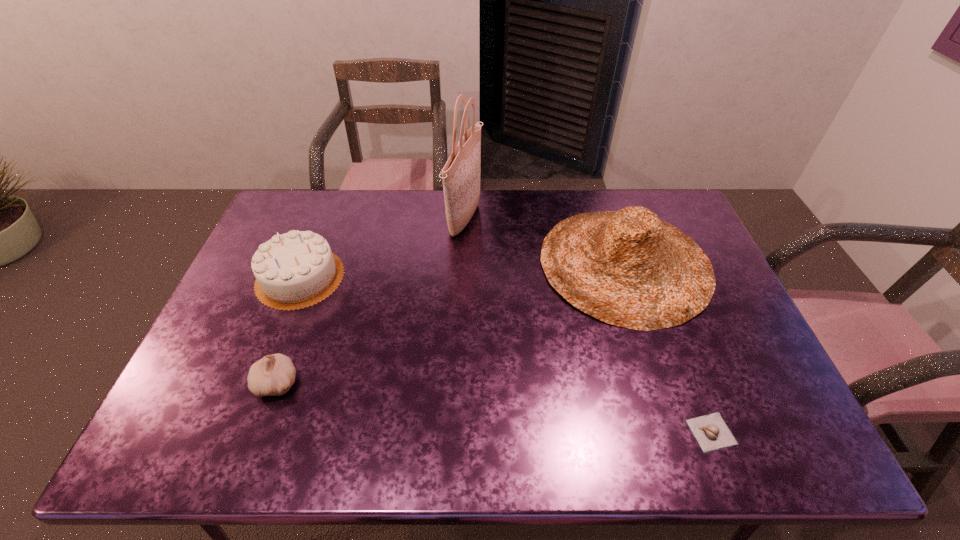
At what (x,y) coordinates should I click in order to perform the action: click on free area in between the sunhat and the second shortest object. Please return your answer as a coordinate pair (x, y). The width and height of the screenshot is (960, 540). Looking at the image, I should click on (451, 323).

Identify the location of free space between the taller garlic and the shortest object. The image size is (960, 540). (494, 408).

This screenshot has height=540, width=960. I want to click on free space that is in between the nearer garlic and the sunhat, so click(x=668, y=348).

Where is `vacant space that is in between the tallest object and the fourth farthest object`? Image resolution: width=960 pixels, height=540 pixels. vacant space that is in between the tallest object and the fourth farthest object is located at coordinates (371, 301).

Locate an element on the screen. unoccupied position between the farther garlic and the third object from left to right is located at coordinates (371, 301).

Identify the location of free spot between the third shortest object and the third object from right to left. This screenshot has height=540, width=960. (382, 249).

At what (x,y) coordinates should I click in order to perform the action: click on object that ranks as the fourth closest to the second tallest object. Please return your answer as a coordinate pair (x, y). Looking at the image, I should click on (274, 374).

This screenshot has width=960, height=540. I want to click on object that ranks as the second closest to the third object from right to left, so click(x=295, y=270).

The height and width of the screenshot is (540, 960). Identify the location of vacant area that satisfies the following two spatial constraints: 1. on the front side of the nearest object; 2. on the left side of the third tallest object. (239, 432).

Locate an element on the screen. free space that satisfies the following two spatial constraints: 1. on the back side of the tallest object; 2. on the right side of the taller garlic is located at coordinates (336, 220).